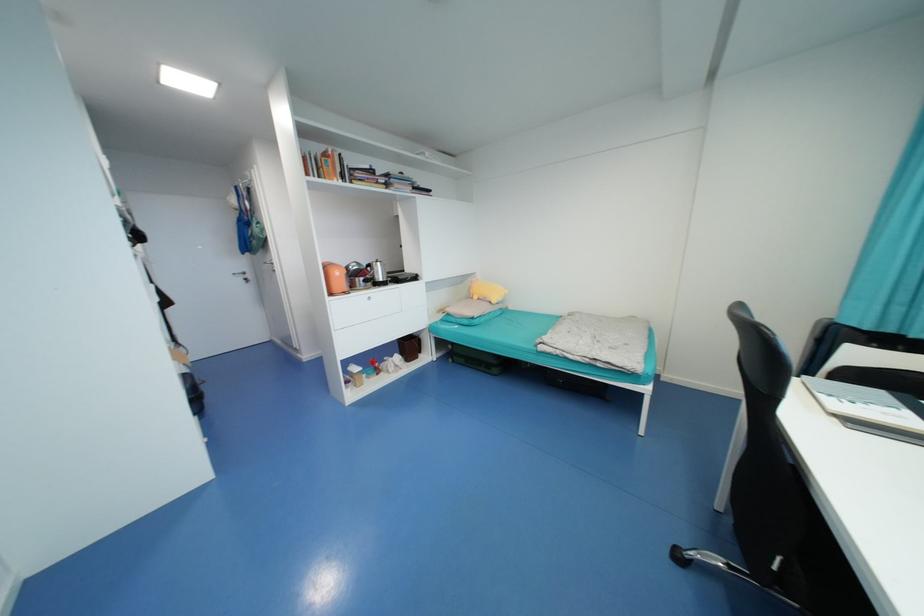
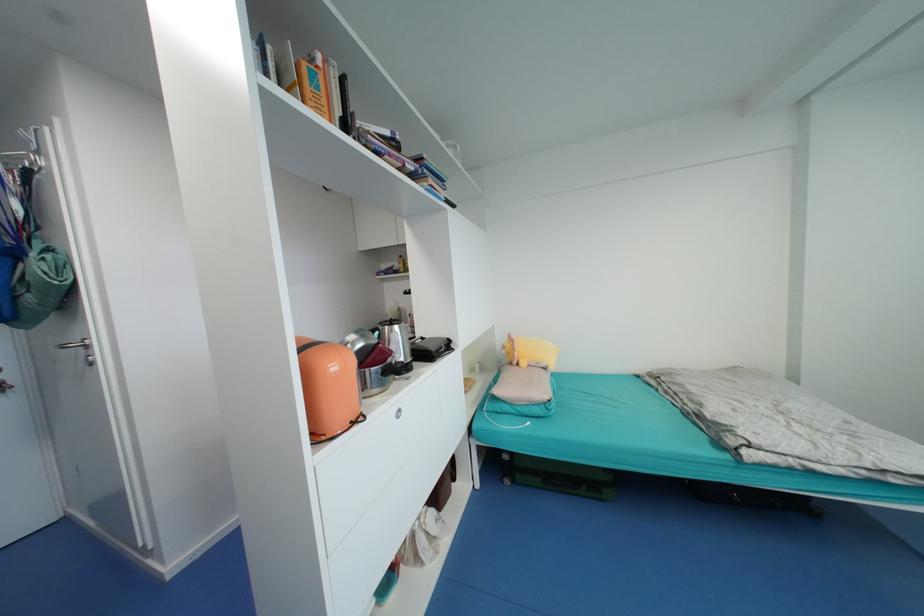
Locate, in the second image, the point that corresponds to point 480,299 in the first image.

(529, 365)